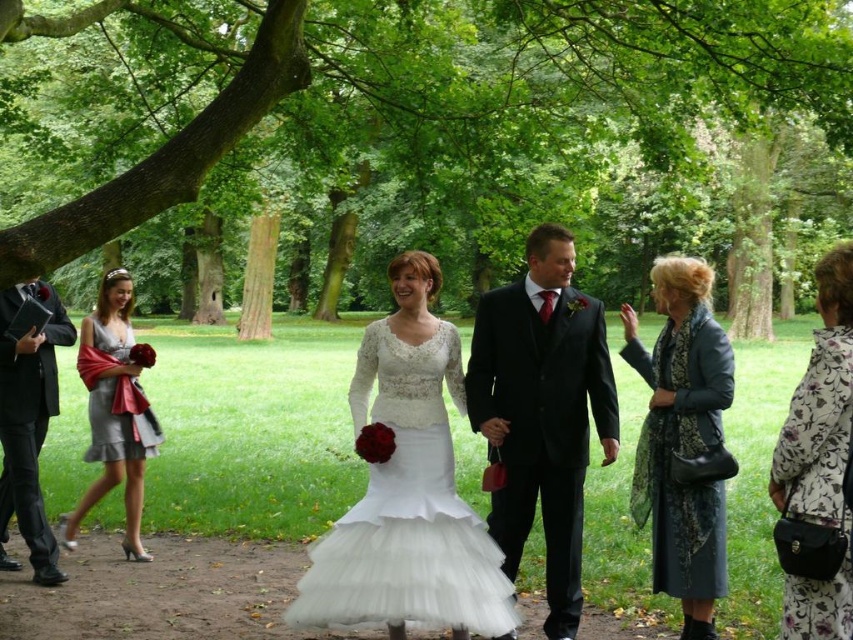
Question: Does white tulle dress at center appear on the right side of leather jacket at right?

Choices:
 (A) no
 (B) yes

Answer: (A)

Question: Which object is closer to the camera taking this photo?

Choices:
 (A) white lace dress at center
 (B) matte black jacket at left

Answer: (A)

Question: Is white lace dress at center further to the viewer compared to satin silver dress at left?

Choices:
 (A) no
 (B) yes

Answer: (A)

Question: Is floral-patterned fabric dress at lower right in front of satin silver dress at left?

Choices:
 (A) yes
 (B) no

Answer: (A)

Question: Estimate the real-world distances between objects in this image. Which object is closer to the white tulle dress at center?

Choices:
 (A) silver satin dress at left
 (B) matte black jacket at left

Answer: (B)

Question: Which of the following is the farthest from the observer?

Choices:
 (A) matte black jacket at left
 (B) green leafy tree at upper center

Answer: (A)